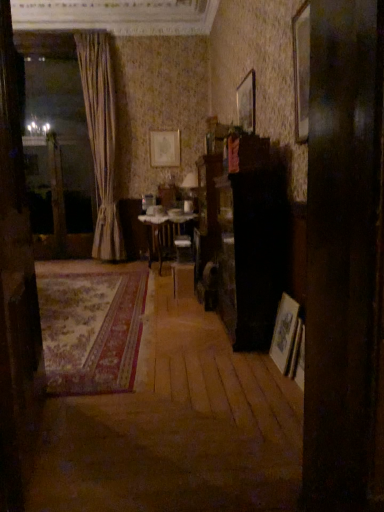
The height and width of the screenshot is (512, 384). Identify the location of free area in between wooden picture frame at right, arranged as the 1th picture frame when ordered from the bottom, and wooden door at left. [x=165, y=402].